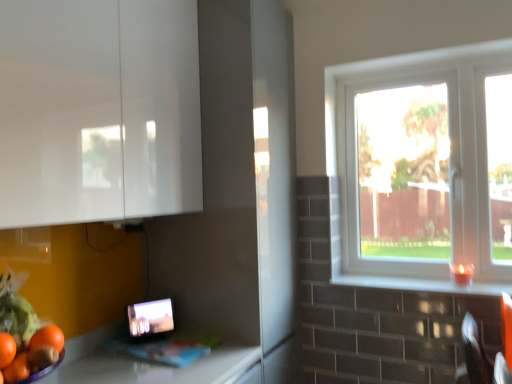
Where is `free location to the right of matte black tablet at lower left`? This screenshot has width=512, height=384. free location to the right of matte black tablet at lower left is located at coordinates (188, 340).